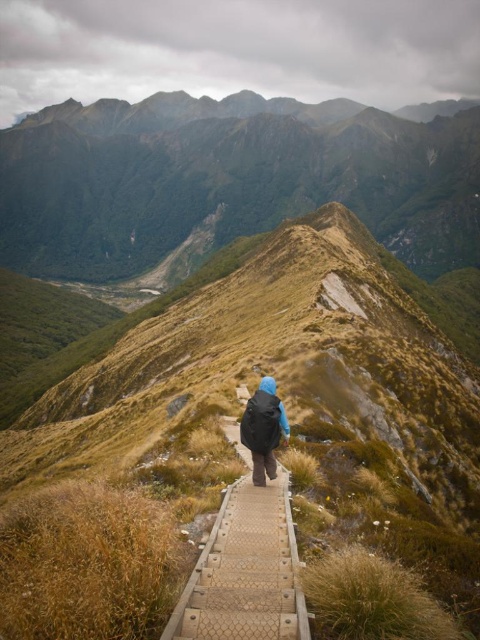
Consider the image. Is green mossy mountain at upper center taller than textured wooden boardwalk at center?

Yes, green mossy mountain at upper center is taller than textured wooden boardwalk at center.

Can you confirm if green mossy mountain at upper center is positioned above textured wooden boardwalk at center?

Indeed, green mossy mountain at upper center is positioned over textured wooden boardwalk at center.

Which is behind, point (88, 168) or point (262, 566)?

The point (88, 168) is behind.

Locate an element on the screen. The height and width of the screenshot is (640, 480). green mossy mountain at upper center is located at coordinates (228, 179).

Who is taller, brown grassy hill at center or textured wooden boardwalk at center?

With more height is brown grassy hill at center.

Who is more distant from viewer, (61, 360) or (216, 568)?

The point (61, 360) is behind.

You are a GUI agent. You are given a task and a screenshot of the screen. Output one action in this format:
    pyautogui.click(x=<x>, y=<y>)
    Task: Click on the brown grassy hill at center
    Image resolution: width=480 pixels, height=640 pixels.
    Given the screenshot: What is the action you would take?
    pyautogui.click(x=226, y=442)

Consider the image. Between brown grassy hill at center and green mossy mountain at upper center, which one appears on the left side from the viewer's perspective?

From the viewer's perspective, brown grassy hill at center appears more on the left side.

This screenshot has width=480, height=640. Find the location of `brown grassy hill at center`. brown grassy hill at center is located at coordinates (226, 442).

Locate an element on the screen. This screenshot has width=480, height=640. brown grassy hill at center is located at coordinates (226, 442).